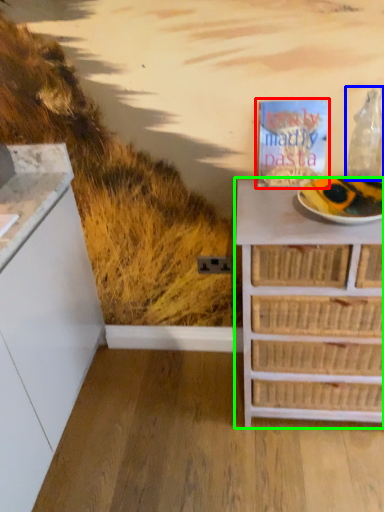
Question: Which is farther away from magazine (highlighted by a red box)? wine bottle (highlighted by a blue box) or chest of drawers (highlighted by a green box)?

Choices:
 (A) wine bottle
 (B) chest of drawers

Answer: (B)